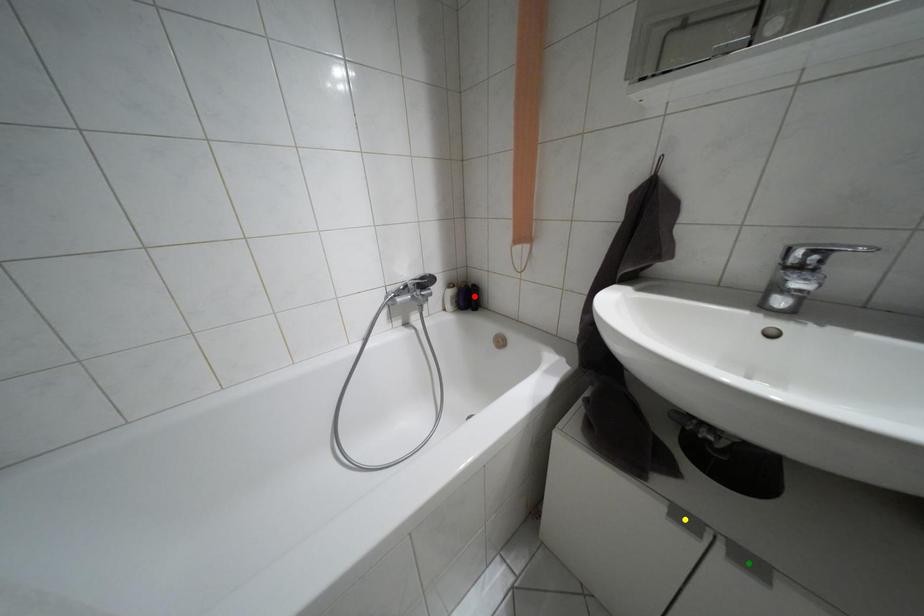
Order these from nearest to farthest:
green point, yellow point, red point

green point < yellow point < red point